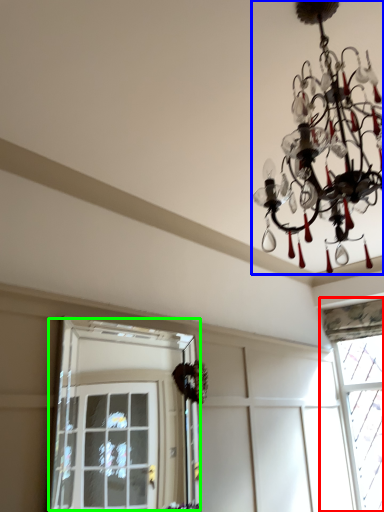
Question: Which object is positioned farthest from window (highlighted by a red box)? Select from lamp (highlighted by a blue box) and window (highlighted by a green box).

Choices:
 (A) lamp
 (B) window

Answer: (A)